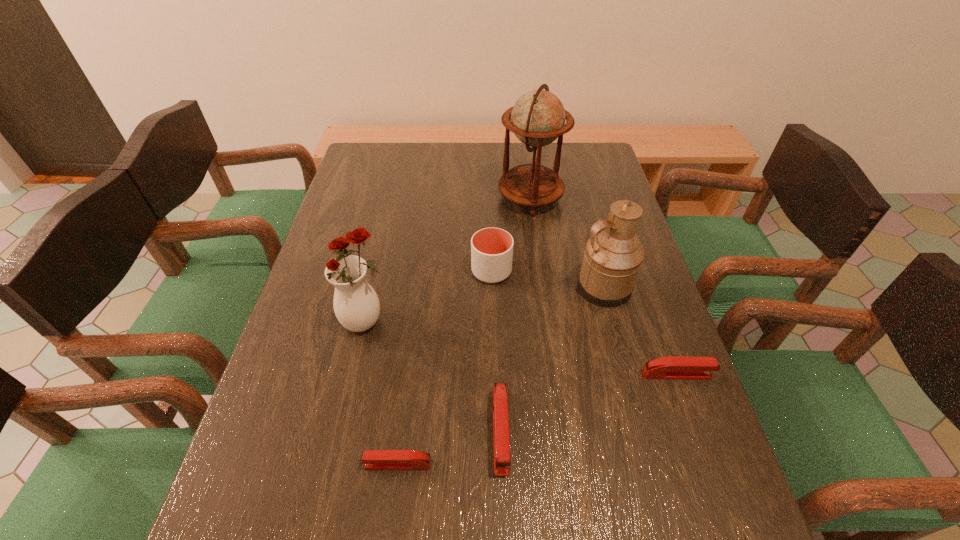
If the aim is uniform spacing by inserting an additional stapler_(stapling_machine) among them, please point to a vacant space for this new stapler_(stapling_machine). Please provide its 2D coordinates. Your answer should be formatted as a tuple, i.e. [(x, y)], where the tuple contains the x and y coordinates of a point satisfying the conditions above.

[(593, 402)]